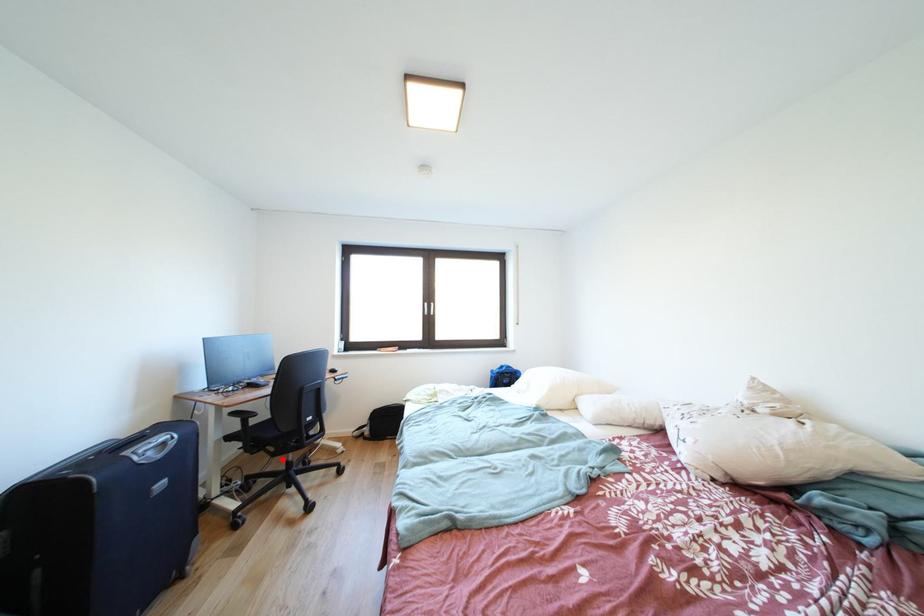
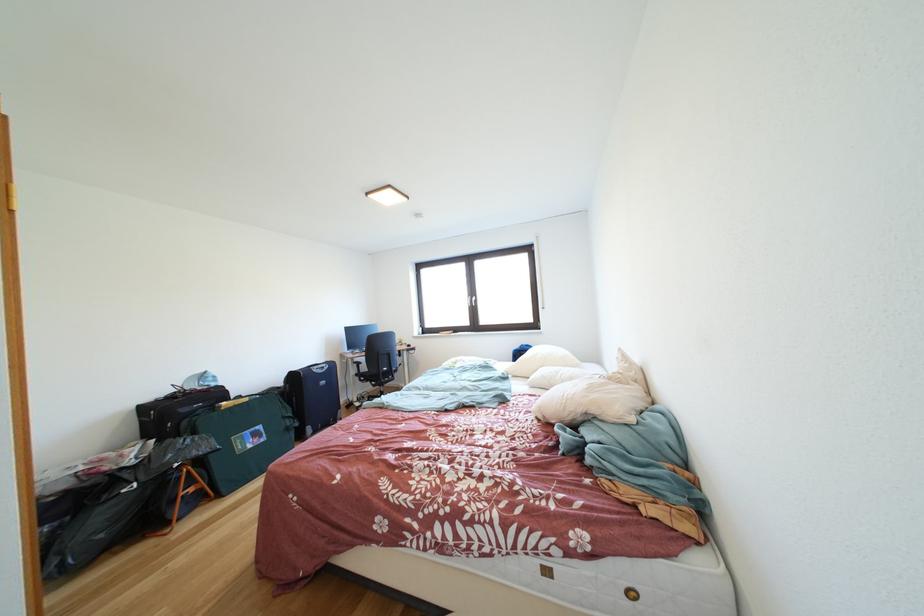
Where in the second image is the point corresponding to the highlighted location from the first image?

(383, 391)